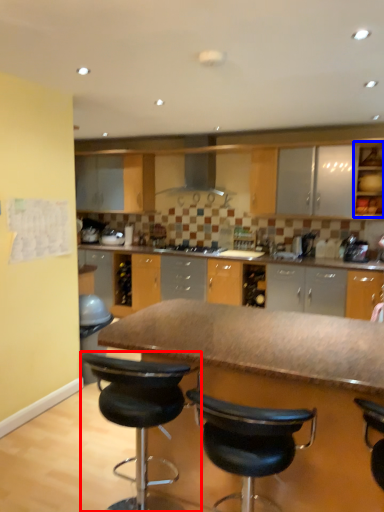
Question: Which point is closer to the camera, chair (highlighted by a red box) or cabinetry (highlighted by a blue box)?

Choices:
 (A) chair
 (B) cabinetry

Answer: (A)